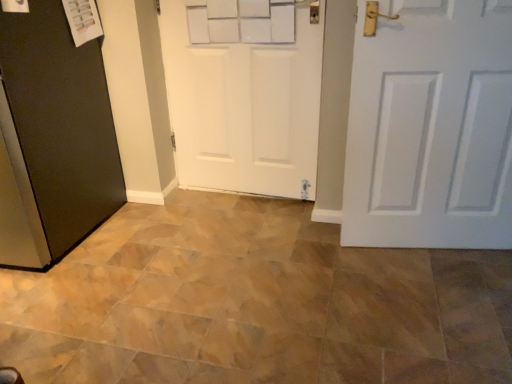
Locate an element on the screen. The image size is (512, 384). vacant region below white matte door at center, the first door positioned from the right (from a real-world perspective) is located at coordinates (425, 251).